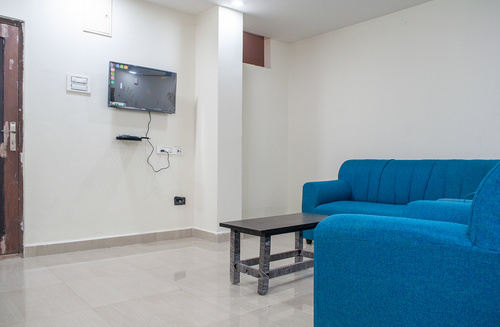
Image resolution: width=500 pixels, height=327 pixels. What are the coordinates of `outlet` in the screenshot? It's located at (170, 149).